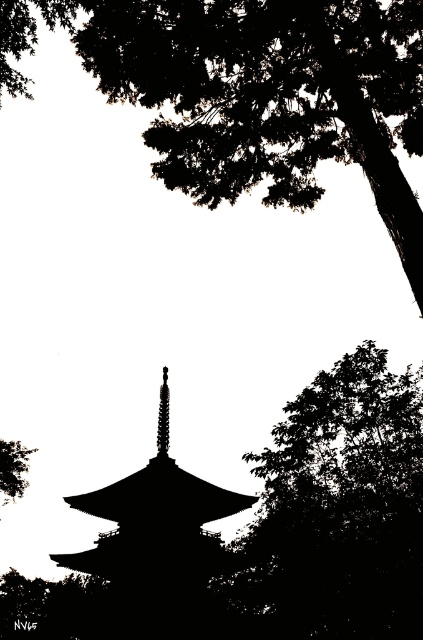
Question: Which point is farther to the camera?

Choices:
 (A) (342, 136)
 (B) (54, 637)

Answer: (B)

Question: Considering the relative positions of black leafy tree at upper center and green leafy tree at lower left in the image provided, where is black leafy tree at upper center located with respect to green leafy tree at lower left?

Choices:
 (A) above
 (B) below

Answer: (A)

Question: Is black leafy tree at upper center to the left of dark green leafy tree at center from the viewer's perspective?

Choices:
 (A) no
 (B) yes

Answer: (A)

Question: Which point is farther to the camera?

Choices:
 (A) dark green leafy tree at center
 (B) smooth silver spire at center
 (C) black leafy tree at upper center

Answer: (B)

Question: Which object is the farthest from the dark green leafy tree at center?

Choices:
 (A) black matte tower at center
 (B) green leafy tree at lower left
 (C) silhouette leafy tree at right
 (D) smooth silver spire at center

Answer: (A)

Question: Does silhouette leafy tree at right have a larger size compared to dark green leafy tree at center?

Choices:
 (A) yes
 (B) no

Answer: (B)